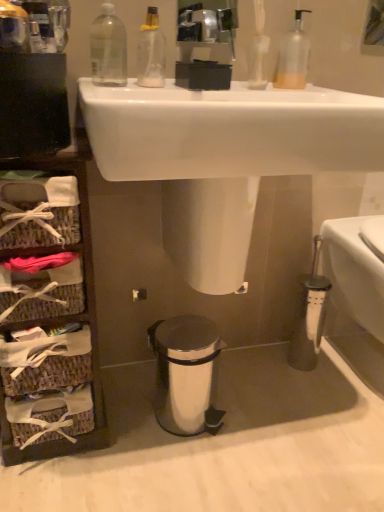
At what (x,y) coordinates should I click in order to perform the action: click on vacant area on the back side of silver metallic trash can at lower center. Please return your answer as a coordinate pair (x, y). The image size is (384, 512). Looking at the image, I should click on click(x=211, y=372).